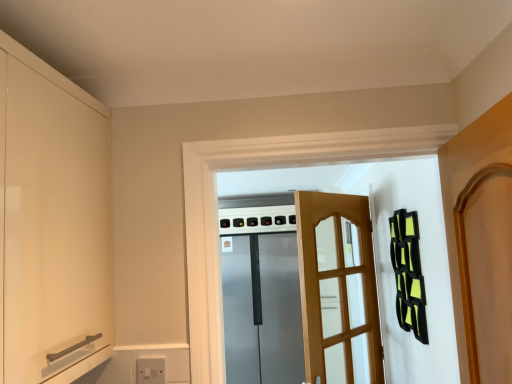
Question: From a real-world perspective, is satin silver refrigerator at center, marked as the 1th screen door in a back-to-front arrangement, beneath light brown wooden screen door at center, which is counted as the 1th screen door, starting from the front?

Choices:
 (A) no
 (B) yes

Answer: (B)

Question: Is light brown wooden screen door at center, which is the second screen door from back to front, a part of satin silver refrigerator at center, marked as the 1th screen door in a back-to-front arrangement?

Choices:
 (A) no
 (B) yes

Answer: (A)

Question: Considering the relative positions of satin silver refrigerator at center, the 2th screen door viewed from the front, and light brown wooden screen door at center, which is the second screen door from back to front, in the image provided, is satin silver refrigerator at center, the 2th screen door viewed from the front, to the left of light brown wooden screen door at center, which is the second screen door from back to front, from the viewer's perspective?

Choices:
 (A) yes
 (B) no

Answer: (A)

Question: Can you confirm if satin silver refrigerator at center, marked as the 1th screen door in a back-to-front arrangement, is bigger than light brown wooden screen door at center, which is the second screen door from back to front?

Choices:
 (A) yes
 (B) no

Answer: (A)

Question: From the image's perspective, is satin silver refrigerator at center, marked as the 1th screen door in a back-to-front arrangement, beneath light brown wooden screen door at center, which is counted as the 1th screen door, starting from the front?

Choices:
 (A) no
 (B) yes

Answer: (B)

Question: Is satin silver refrigerator at center, the 2th screen door viewed from the front, positioned in front of light brown wooden screen door at center, which is the second screen door from back to front?

Choices:
 (A) yes
 (B) no

Answer: (B)

Question: Does matte white cabinet at left have a greater height compared to satin silver refrigerator at center, marked as the 1th screen door in a back-to-front arrangement?

Choices:
 (A) no
 (B) yes

Answer: (A)

Question: Is matte white cabinet at left facing away from satin silver refrigerator at center, marked as the 1th screen door in a back-to-front arrangement?

Choices:
 (A) yes
 (B) no

Answer: (B)

Question: From the image's perspective, is matte white cabinet at left located above satin silver refrigerator at center, the 2th screen door viewed from the front?

Choices:
 (A) yes
 (B) no

Answer: (A)

Question: Is matte white cabinet at left wider than satin silver refrigerator at center, the 2th screen door viewed from the front?

Choices:
 (A) no
 (B) yes

Answer: (A)

Question: From the image's perspective, does matte white cabinet at left appear lower than satin silver refrigerator at center, marked as the 1th screen door in a back-to-front arrangement?

Choices:
 (A) no
 (B) yes

Answer: (A)

Question: Is matte white cabinet at left not within satin silver refrigerator at center, marked as the 1th screen door in a back-to-front arrangement?

Choices:
 (A) no
 (B) yes

Answer: (B)

Question: Does matte white cabinet at left have a greater height compared to light brown wooden screen door at center, which is counted as the 1th screen door, starting from the front?

Choices:
 (A) yes
 (B) no

Answer: (B)